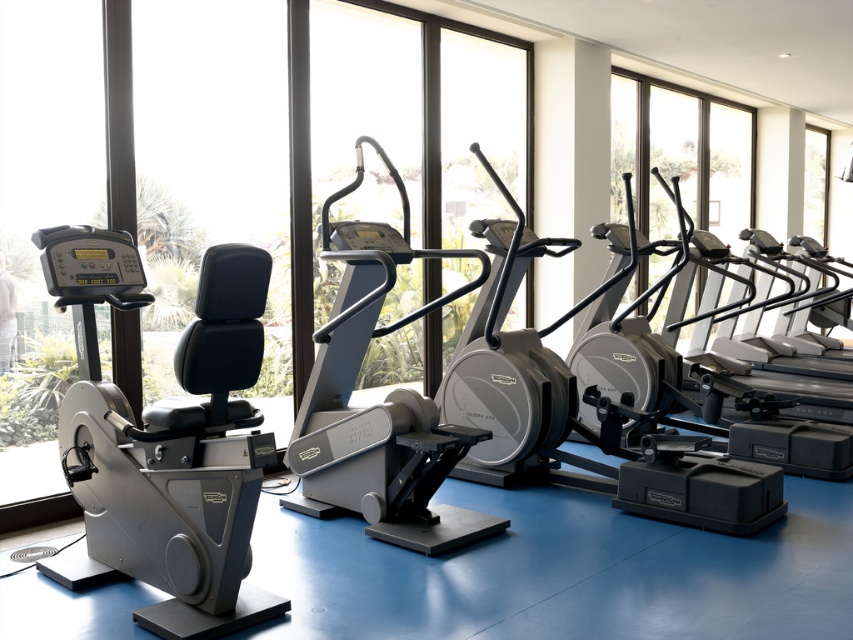
You are a gym member who wants to see the view outside through the transparent glass windows at upper right while exercising. Can you position yourself on the matte black exercise bike at left to face the windows?

The matte black exercise bike at left is to the left of the transparent glass windows at upper right, so if you face towards the windows from the bike, you can see the view outside.

You are a personal trainer who wants to place a new poster on the wall. The poster is 1.5 meters tall. You have two options for placement areas near the matte black exercise bike at left and the transparent glass windows at upper right. Based on their heights, which location would allow the poster to be fully visible without being obstructed?

The transparent glass windows at upper right are taller than the matte black exercise bike at left. Since the poster is 1.5 meters tall, placing it near the transparent glass windows at upper right would ensure it is fully visible without obstruction because the windows are taller.

You are standing in the gym and want to place a new poster on the wall between the two points, point (224, 252) and point (747, 177). Which point is closer to you so the poster can be placed at that closer position?

Point (224, 252) is closer to the viewer than point (747, 177), so the poster should be placed at point (224, 252).